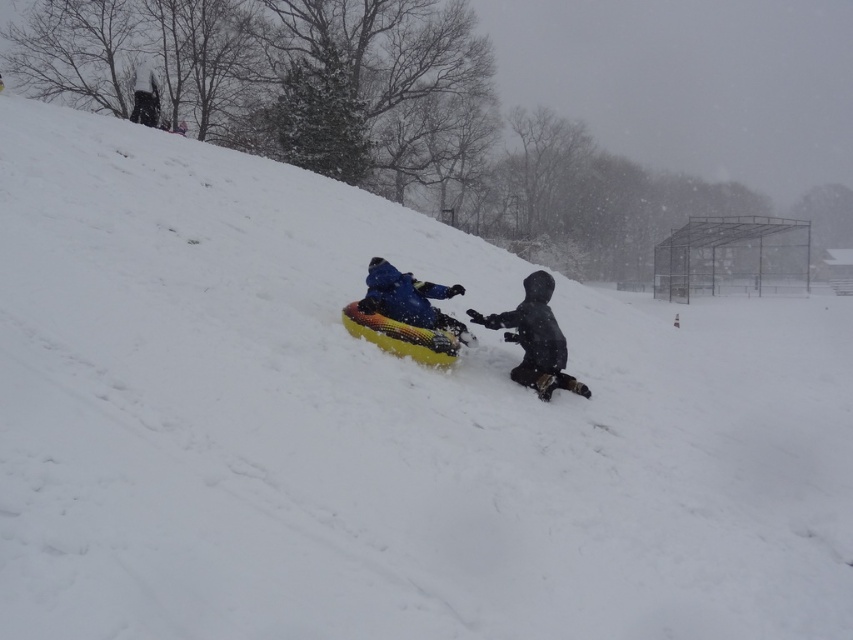
Question: Among these objects, which one is farthest from the camera?

Choices:
 (A) blue fabric jacket at center
 (B) black matte snowsuit at lower right

Answer: (B)

Question: Which object is farther from the camera taking this photo?

Choices:
 (A) blue fabric jacket at center
 (B) black matte snowsuit at lower right

Answer: (B)

Question: Among these points, which one is farthest from the camera?

Choices:
 (A) (532, 384)
 (B) (389, 292)

Answer: (A)

Question: Is black matte snowsuit at lower right above blue fabric jacket at center?

Choices:
 (A) no
 (B) yes

Answer: (A)

Question: Can you confirm if black matte snowsuit at lower right is bigger than blue fabric jacket at center?

Choices:
 (A) no
 (B) yes

Answer: (A)

Question: Is black matte snowsuit at lower right below blue fabric jacket at center?

Choices:
 (A) no
 (B) yes

Answer: (B)